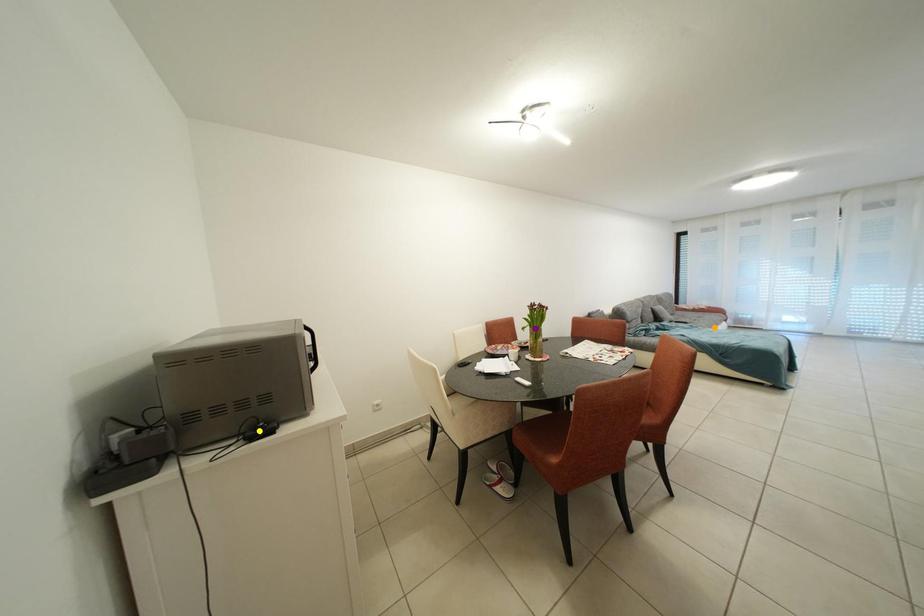
Order these from nearest to farthest:
purple point, yellow point, orange point

yellow point, purple point, orange point